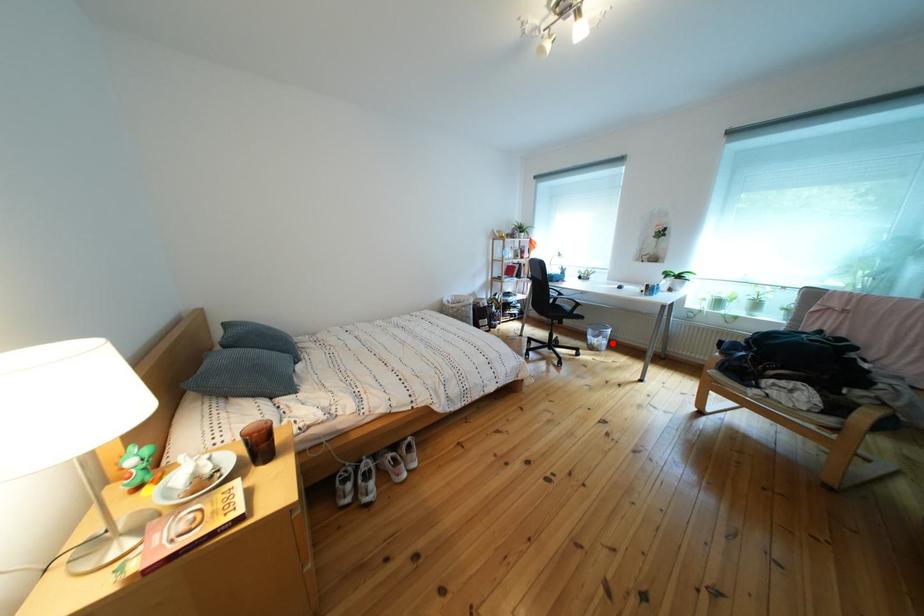
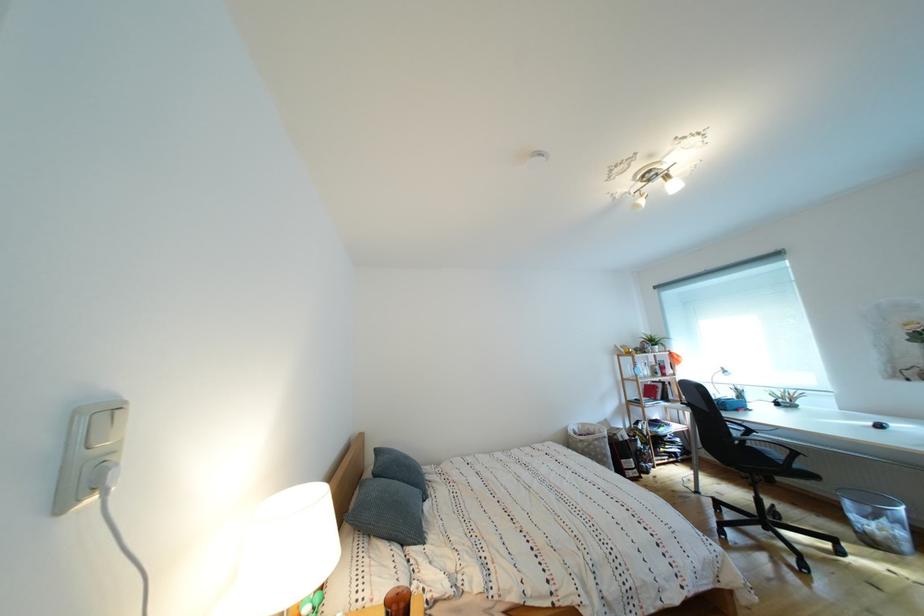
The point at the highlighted location is marked in the first image. Where is the corresponding point in the second image?

(896, 527)